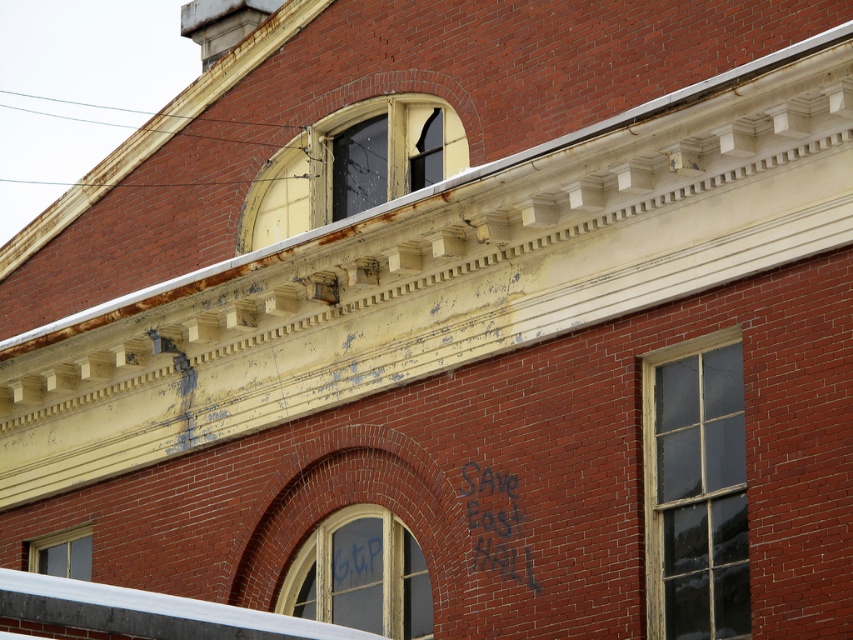
Does clear glass window at center have a lesser width compared to clear glass window at lower left?

Correct, clear glass window at center's width is less than clear glass window at lower left's.

Is point (312, 548) closer to viewer compared to point (65, 536)?

Yes, it is.

This screenshot has height=640, width=853. I want to click on clear glass window at center, so (361, 576).

At what (x,y) coordinates should I click in order to perform the action: click on clear glass window at center. Please return your answer as a coordinate pair (x, y). This screenshot has width=853, height=640. Looking at the image, I should click on (361, 576).

Is point (747, 563) positioned before point (351, 124)?

Yes, it is in front of point (351, 124).

Is point (671, 496) positioned behind point (258, 173)?

No, (671, 496) is closer to viewer.

You are a GUI agent. You are given a task and a screenshot of the screen. Output one action in this format:
    pyautogui.click(x=<x>, y=<y>)
    Task: Click on the wooden window at center
    
    Given the screenshot: What is the action you would take?
    pyautogui.click(x=695, y=490)

Can you confirm if wooden window at center is positioned to the left of clear glass window at lower left?

Incorrect, wooden window at center is not on the left side of clear glass window at lower left.

Does wooden window at center have a larger size compared to clear glass window at lower left?

Yes, wooden window at center is bigger than clear glass window at lower left.

Is point (688, 621) closer to viewer compared to point (74, 540)?

Yes, it is in front of point (74, 540).

At what (x,y) coordinates should I click in order to perform the action: click on wooden window at center. Please return your answer as a coordinate pair (x, y). This screenshot has width=853, height=640. Looking at the image, I should click on (695, 490).